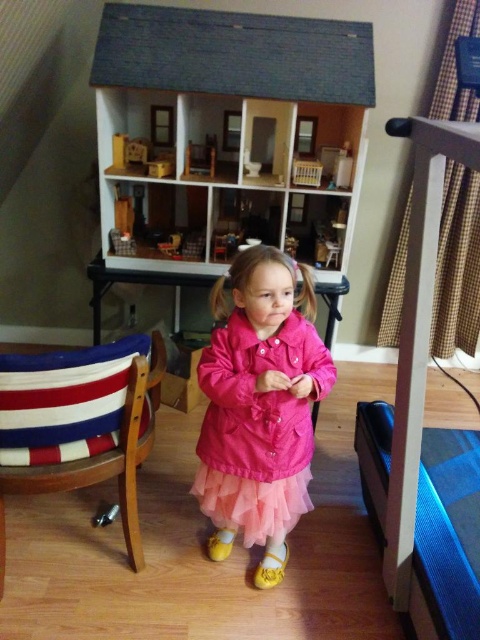
You are a toy designer trying to fit a new miniature toy into the scene. The toy is 3 cm thick. You have to choose between placing it either behind the pink matte coat at center or behind the striped fabric chair at lower left. Which object allows the toy to be placed behind without overlapping?

The pink matte coat at center is thinner than the striped fabric chair at lower left, so the toy can be placed behind the pink matte coat at center as it has less thickness, allowing space for the toy without overlapping.

Based on the photo, you are a parent looking at the dollhouse scene. There is a point at coordinates (261, 410) in the image. What object is located at that point?

The pink matte coat at center is located at point (261, 410).

You are a parent trying to decide if your child can safely view the blue fabric bunk bed at right from their current position. The child is 110 centimeters tall. Can they see the top of the bunk bed?

The blue fabric bunk bed at right is 95.05 centimeters from viewer. Since the child is 110 centimeters tall, they can see the top of the blue fabric bunk bed at right as their height exceeds the distance to the bed.